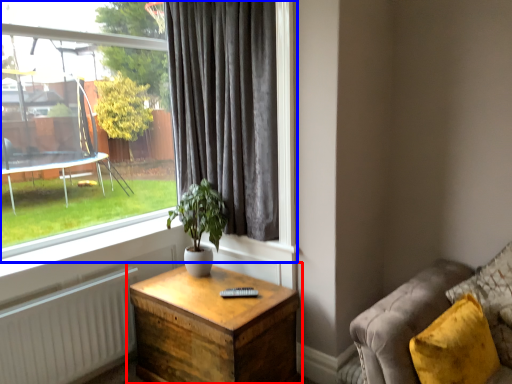
Question: Which of the following is the farthest to the observer, nightstand (highlighted by a red box) or window (highlighted by a blue box)?

Choices:
 (A) nightstand
 (B) window

Answer: (B)